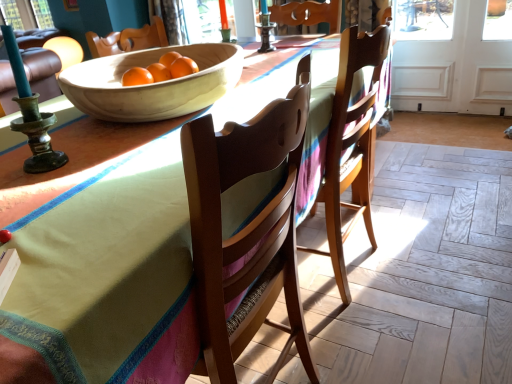
Question: Would you say wooden table at center contains matte dark brown candle holder at upper center?

Choices:
 (A) yes
 (B) no

Answer: (B)

Question: Is wooden table at center taller than matte dark brown candle holder at upper center?

Choices:
 (A) yes
 (B) no

Answer: (A)

Question: Could you tell me if wooden table at center is turned towards matte dark brown candle holder at upper center?

Choices:
 (A) yes
 (B) no

Answer: (B)

Question: From a real-world perspective, does wooden table at center stand above matte dark brown candle holder at upper center?

Choices:
 (A) no
 (B) yes

Answer: (A)

Question: Is wooden table at center outside matte dark brown candle holder at upper center?

Choices:
 (A) yes
 (B) no

Answer: (A)

Question: Is matte dark brown candle holder at upper center taller or shorter than white wood screen door at right?

Choices:
 (A) short
 (B) tall

Answer: (A)

Question: Is matte dark brown candle holder at upper center wider or thinner than white wood screen door at right?

Choices:
 (A) thin
 (B) wide

Answer: (B)

Question: From the image's perspective, relative to white wood screen door at right, is matte dark brown candle holder at upper center above or below?

Choices:
 (A) below
 (B) above

Answer: (A)

Question: In terms of size, does matte dark brown candle holder at upper center appear bigger or smaller than white wood screen door at right?

Choices:
 (A) small
 (B) big

Answer: (A)

Question: From a real-world perspective, is natural wood bowl at center above or below wooden table at center?

Choices:
 (A) below
 (B) above

Answer: (B)

Question: Does point (190, 81) appear closer or farther from the camera than point (167, 349)?

Choices:
 (A) farther
 (B) closer

Answer: (A)

Question: Is natural wood bowl at center taller or shorter than wooden table at center?

Choices:
 (A) short
 (B) tall

Answer: (A)

Question: Would you say natural wood bowl at center is inside or outside wooden table at center?

Choices:
 (A) outside
 (B) inside

Answer: (A)

Question: Considering the positions of natural wood bowl at center and matte dark brown candle holder at upper center in the image, is natural wood bowl at center bigger or smaller than matte dark brown candle holder at upper center?

Choices:
 (A) small
 (B) big

Answer: (B)

Question: From the image's perspective, relative to matte dark brown candle holder at upper center, is natural wood bowl at center above or below?

Choices:
 (A) below
 (B) above

Answer: (A)